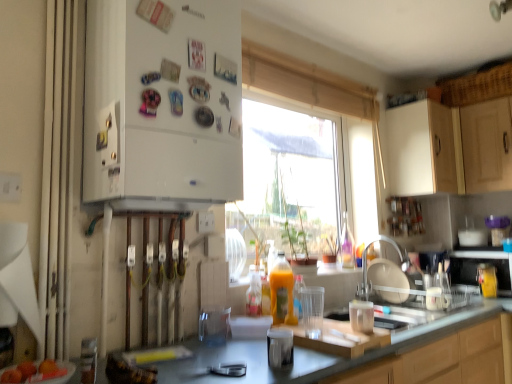
Question: Is white matte cabinet at upper right, marked as the 1th cabinetry in a back-to-front arrangement, wider or thinner than white fabric curtain at left?

Choices:
 (A) thin
 (B) wide

Answer: (B)

Question: Choose the correct answer: Is white matte cabinet at upper right, marked as the 1th cabinetry in a back-to-front arrangement, inside white fabric curtain at left or outside it?

Choices:
 (A) inside
 (B) outside

Answer: (B)

Question: Based on their relative distances, which object is farther from the white matte refrigerator at left, the 1th cabinetry positioned from the left?

Choices:
 (A) white matte cabinet at upper right, marked as the 1th cabinetry in a back-to-front arrangement
 (B) translucent glass cup at center, which is counted as the 1th appliance, starting from the left
 (C) white fabric curtain at left
 (D) translucent plastic bottle at center
 (E) smooth black countertop at center

Answer: (A)

Question: Estimate the real-world distances between objects in this image. Which object is closer to the smooth black countertop at center?

Choices:
 (A) metallic silver microwave at right, which is the 1th appliance from back to front
 (B) transparent plastic coffee machine at right
 (C) satin nickel faucet at sink right
 (D) white matte cabinet at upper right, marked as the 1th cabinetry in a back-to-front arrangement
 (E) translucent glass cup at center, which appears as the second appliance when viewed from the back

Answer: (E)